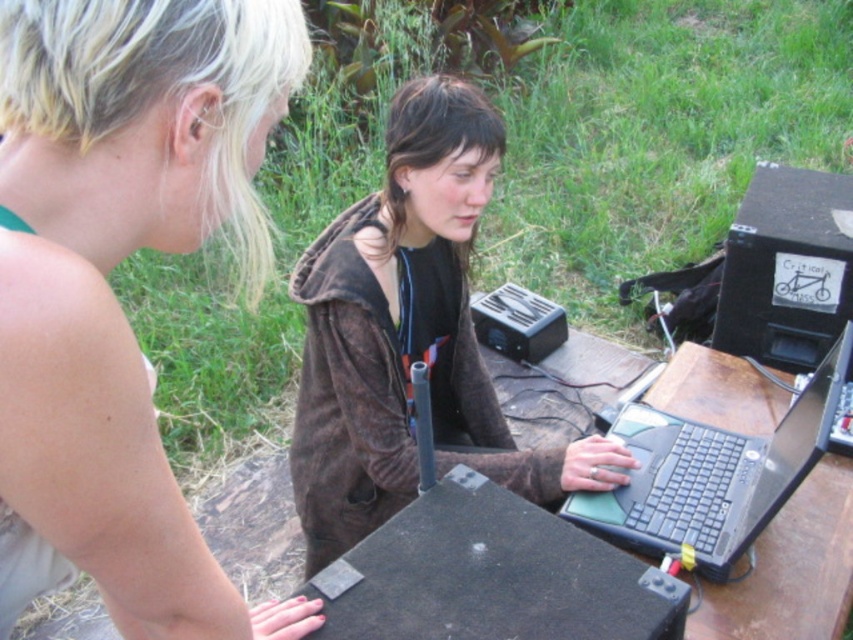
Question: Among these points, which one is nearest to the camera?

Choices:
 (A) (457, 365)
 (B) (210, 624)
 (C) (654, 499)
 (D) (637, 413)

Answer: (B)

Question: Does brown suede jacket at center have a larger size compared to black plastic laptop at center?

Choices:
 (A) yes
 (B) no

Answer: (A)

Question: Where is dark brown wooden picnic table at center located in relation to black plastic laptop at center in the image?

Choices:
 (A) right
 (B) left

Answer: (A)

Question: Which object is farther from the camera taking this photo?

Choices:
 (A) blonde hair at upper left
 (B) dark brown wooden picnic table at center
 (C) black plastic laptop at center
 (D) brown suede jacket at center

Answer: (D)

Question: Is brown suede jacket at center above black plastic laptop at center?

Choices:
 (A) yes
 (B) no

Answer: (A)

Question: Which point appears closest to the camera in this image?

Choices:
 (A) (756, 472)
 (B) (795, 433)

Answer: (B)